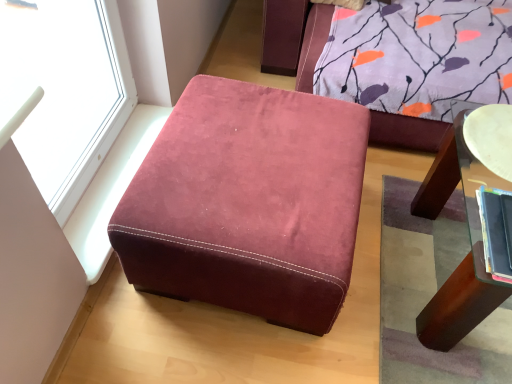
Image resolution: width=512 pixels, height=384 pixels. Find the location of `suede-like burgundy ottoman at center`. suede-like burgundy ottoman at center is located at coordinates (248, 203).

From a real-world perspective, is transparent glass window at upper left above or below white glossy plate at upper right?

From a real-world perspective, transparent glass window at upper left is physically above white glossy plate at upper right.

Considering the points (57, 25) and (493, 132), which point is behind, point (57, 25) or point (493, 132)?

The point (57, 25) is farther from the camera.

Is transparent glass window at upper left aimed at white glossy plate at upper right?

Yes.

In terms of size, does transparent glass window at upper left appear bigger or smaller than white glossy plate at upper right?

Considering their sizes, transparent glass window at upper left takes up more space than white glossy plate at upper right.

Which of these two, white glossy plate at upper right or suede-like burgundy ottoman at center, is smaller?

Smaller between the two is white glossy plate at upper right.

Looking at their sizes, would you say white glossy plate at upper right is wider or thinner than suede-like burgundy ottoman at center?

white glossy plate at upper right is thinner than suede-like burgundy ottoman at center.

Considering the relative positions of white glossy plate at upper right and suede-like burgundy ottoman at center in the image provided, is white glossy plate at upper right to the left of suede-like burgundy ottoman at center from the viewer's perspective?

No.

From a real-world perspective, who is located lower, white glossy plate at upper right or suede-like burgundy ottoman at center?

suede-like burgundy ottoman at center.

Which of these two, white glossy plate at upper right or hardcover book at right, is smaller?

Smaller between the two is hardcover book at right.

Is white glossy plate at upper right touching hardcover book at right?

There is a gap between white glossy plate at upper right and hardcover book at right.

Considering the positions of point (497, 121) and point (485, 265), is point (497, 121) closer or farther from the camera than point (485, 265)?

Point (497, 121) is farther from the camera than point (485, 265).

Does suede-like burgundy ottoman at center appear on the left side of transparent glass window at upper left?

No.

Considering the relative sizes of suede-like burgundy ottoman at center and transparent glass window at upper left in the image provided, is suede-like burgundy ottoman at center wider than transparent glass window at upper left?

Indeed, suede-like burgundy ottoman at center has a greater width compared to transparent glass window at upper left.

From a real-world perspective, which object rests below the other?

suede-like burgundy ottoman at center.

Is transparent glass window at upper left completely or partially inside suede-like burgundy ottoman at center?

No, suede-like burgundy ottoman at center does not contain transparent glass window at upper left.

Is hardcover book at right placed right next to suede-like burgundy ottoman at center?

They are not placed beside each other.

In terms of size, does hardcover book at right appear bigger or smaller than suede-like burgundy ottoman at center?

Clearly, hardcover book at right is smaller in size than suede-like burgundy ottoman at center.

Between hardcover book at right and suede-like burgundy ottoman at center, which one has less height?

With less height is hardcover book at right.

Is hardcover book at right looking in the opposite direction of suede-like burgundy ottoman at center?

That's not correct — hardcover book at right is not looking away from suede-like burgundy ottoman at center.

Is transparent glass window at upper left next to hardcover book at right?

transparent glass window at upper left and hardcover book at right are clearly separated.

Is transparent glass window at upper left in front of hardcover book at right?

Yes, the depth of transparent glass window at upper left is less than that of hardcover book at right.

Is suede-like burgundy ottoman at center to the left of white glossy plate at upper right from the viewer's perspective?

Yes, suede-like burgundy ottoman at center is to the left of white glossy plate at upper right.

Would you say suede-like burgundy ottoman at center is inside or outside white glossy plate at upper right?

suede-like burgundy ottoman at center is not inside white glossy plate at upper right, it's outside.

The image size is (512, 384). Find the location of `window above the white glossy plate at upper right (from a real-world perspective)`. window above the white glossy plate at upper right (from a real-world perspective) is located at coordinates (63, 90).

The height and width of the screenshot is (384, 512). What are the coordinates of `furniture lying in front of the white glossy plate at upper right` in the screenshot? It's located at (248, 203).

From the image, which object appears to be nearer to hardcover book at right, white glossy plate at upper right or transparent glass window at upper left?

Among the two, white glossy plate at upper right is located nearer to hardcover book at right.

Considering their positions, is transparent glass window at upper left positioned closer to hardcover book at right than suede-like burgundy ottoman at center?

The object closer to hardcover book at right is suede-like burgundy ottoman at center.

Looking at the image, which one is located further to suede-like burgundy ottoman at center, transparent glass window at upper left or hardcover book at right?

hardcover book at right lies further to suede-like burgundy ottoman at center than the other object.

Which object lies nearer to the anchor point transparent glass window at upper left, suede-like burgundy ottoman at center or white glossy plate at upper right?

The object closer to transparent glass window at upper left is suede-like burgundy ottoman at center.

Which object lies further to the anchor point transparent glass window at upper left, white glossy plate at upper right or hardcover book at right?

hardcover book at right is positioned further to the anchor transparent glass window at upper left.

From the image, which object appears to be nearer to suede-like burgundy ottoman at center, white glossy plate at upper right or transparent glass window at upper left?

Among the two, transparent glass window at upper left is located nearer to suede-like burgundy ottoman at center.

From the image, which object appears to be nearer to hardcover book at right, suede-like burgundy ottoman at center or transparent glass window at upper left?

suede-like burgundy ottoman at center lies closer to hardcover book at right than the other object.

Considering their positions, is suede-like burgundy ottoman at center positioned further to hardcover book at right than white glossy plate at upper right?

Based on the image, suede-like burgundy ottoman at center appears to be further to hardcover book at right.

Where is `book between suede-like burgundy ottoman at center and white glossy plate at upper right in the horizontal direction`? This screenshot has height=384, width=512. book between suede-like burgundy ottoman at center and white glossy plate at upper right in the horizontal direction is located at coordinates (494, 233).

Image resolution: width=512 pixels, height=384 pixels. Identify the location of furniture between transparent glass window at upper left and hardcover book at right from left to right. (248, 203).

Locate an element on the screen. Image resolution: width=512 pixels, height=384 pixels. book located between transparent glass window at upper left and white glossy plate at upper right in the left-right direction is located at coordinates tap(494, 233).

Find the location of a particular element. furniture between transparent glass window at upper left and white glossy plate at upper right is located at coordinates [x=248, y=203].